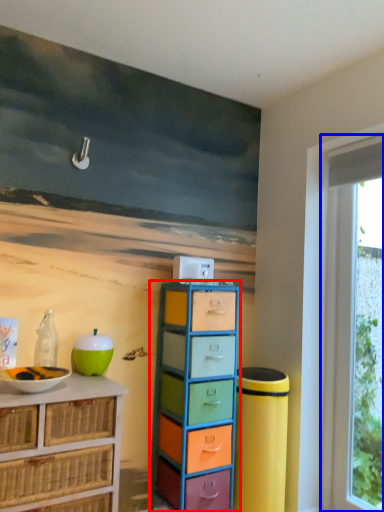
Question: Among these objects, which one is farthest to the camera, chest of drawers (highlighted by a red box) or window (highlighted by a blue box)?

Choices:
 (A) chest of drawers
 (B) window

Answer: (B)